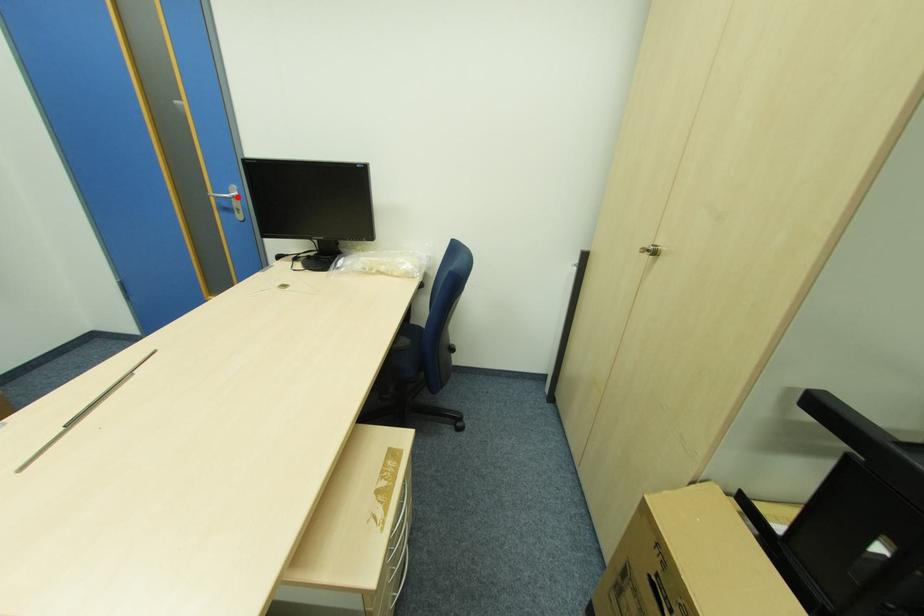
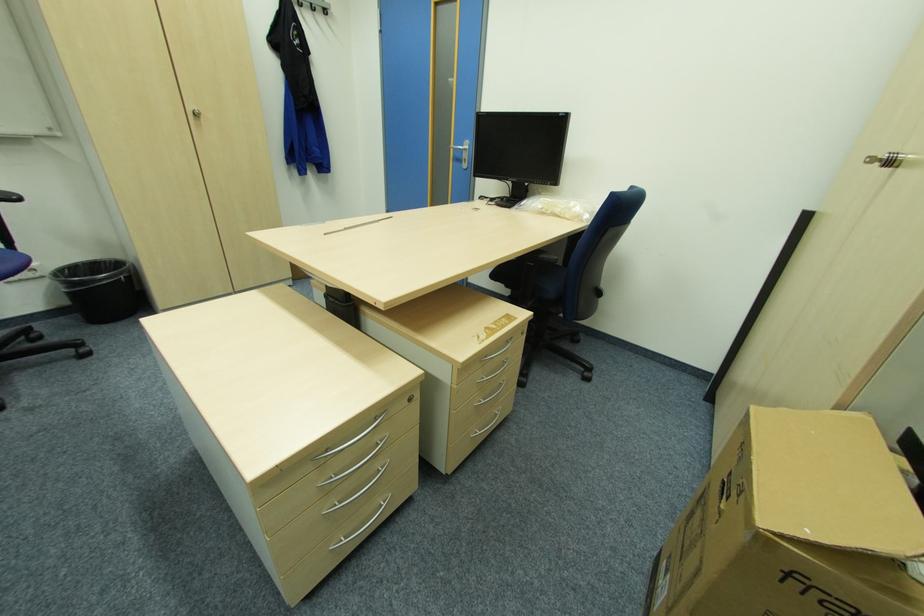
Where in the second image is the point corresponding to the highlighted location from the first image?

(468, 148)